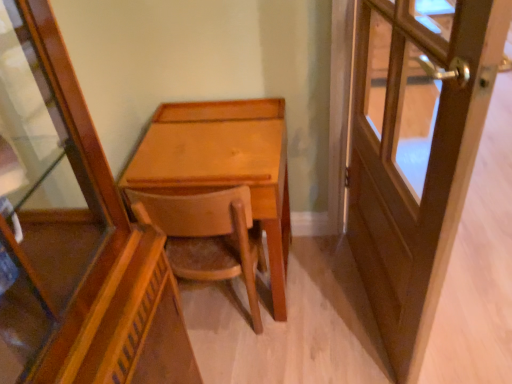
Question: Does wooden chair at center lie behind wooden door at right?

Choices:
 (A) yes
 (B) no

Answer: (A)

Question: Can we say wooden chair at center lies outside wooden door at right?

Choices:
 (A) no
 (B) yes

Answer: (B)

Question: Is wooden chair at center facing away from wooden door at right?

Choices:
 (A) no
 (B) yes

Answer: (A)

Question: Does wooden chair at center have a smaller size compared to wooden door at right?

Choices:
 (A) yes
 (B) no

Answer: (A)

Question: Could you tell me if wooden chair at center is turned towards wooden door at right?

Choices:
 (A) yes
 (B) no

Answer: (B)

Question: Is wooden chair at center wider than wooden door at right?

Choices:
 (A) yes
 (B) no

Answer: (A)

Question: From a real-world perspective, does wooden door at right sit lower than light brown wood desk at center?

Choices:
 (A) no
 (B) yes

Answer: (A)

Question: Is wooden door at right far from light brown wood desk at center?

Choices:
 (A) no
 (B) yes

Answer: (A)

Question: Is wooden door at right shorter than light brown wood desk at center?

Choices:
 (A) yes
 (B) no

Answer: (B)

Question: Does wooden door at right lie behind light brown wood desk at center?

Choices:
 (A) yes
 (B) no

Answer: (B)

Question: Is wooden door at right wider than light brown wood desk at center?

Choices:
 (A) no
 (B) yes

Answer: (A)

Question: Is wooden door at right positioned beyond the bounds of light brown wood desk at center?

Choices:
 (A) no
 (B) yes

Answer: (B)

Question: Is wooden door at right far from wooden chair at center?

Choices:
 (A) no
 (B) yes

Answer: (A)